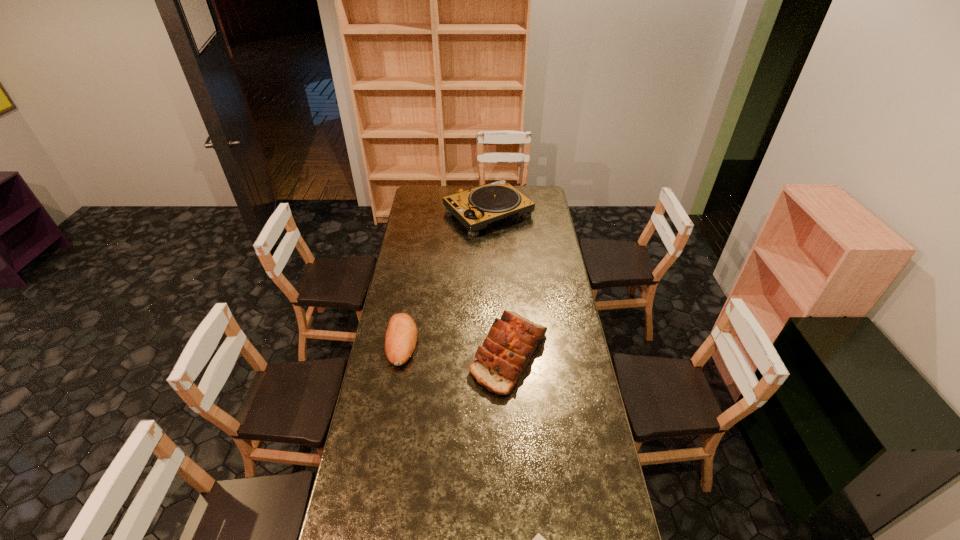
The width and height of the screenshot is (960, 540). Identify the location of bread present at the right edge. (511, 341).

Image resolution: width=960 pixels, height=540 pixels. I want to click on object present at the far right corner, so click(x=475, y=208).

Image resolution: width=960 pixels, height=540 pixels. In order to click on free spot at the far edge of the desktop in this screenshot , I will do `click(521, 186)`.

Find the location of a particular element. free location at the left edge of the desktop is located at coordinates (415, 223).

The height and width of the screenshot is (540, 960). Identify the location of blank space at the right edge of the desktop. [543, 242].

The width and height of the screenshot is (960, 540). What are the coordinates of `vacant area that lies between the right bread and the left bread` in the screenshot? It's located at (456, 348).

The width and height of the screenshot is (960, 540). I want to click on free area in between the right bread and the leftmost object, so click(456, 348).

Where is `free spot between the second shortest object and the taller bread`? This screenshot has height=540, width=960. free spot between the second shortest object and the taller bread is located at coordinates (456, 348).

Locate an element on the screen. free space between the right bread and the record player is located at coordinates (499, 284).

Where is `vacant region between the shorter bread and the farthest object`? Image resolution: width=960 pixels, height=540 pixels. vacant region between the shorter bread and the farthest object is located at coordinates (445, 278).